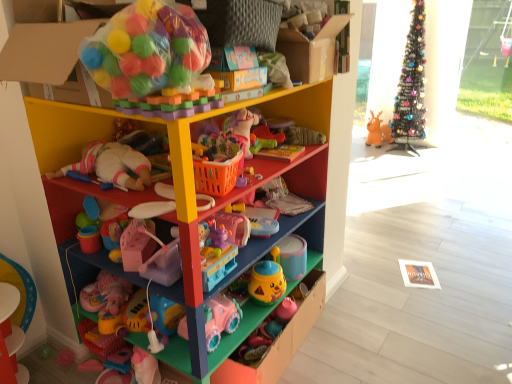
Identify the location of multicolored plastic shelf at center. The height and width of the screenshot is (384, 512). (296, 193).

Locate an element on the screen. Image resolution: width=512 pixels, height=384 pixels. metallic wire christmas tree at upper right is located at coordinates (411, 85).

Describe the element at coordinates (153, 61) in the screenshot. The width and height of the screenshot is (512, 384). I see `translucent plastic ball pit at upper left, which is the first toy from left to right` at that location.

Where is `transparent glass door at upper right`? This screenshot has width=512, height=384. transparent glass door at upper right is located at coordinates (488, 61).

Considering the sizes of objects metallic wire christmas tree at upper right and pink plastic toy at center, positioned as the third toy in front-to-back order, in the image provided, who is wider, metallic wire christmas tree at upper right or pink plastic toy at center, positioned as the third toy in front-to-back order,?

metallic wire christmas tree at upper right is wider.

Are metallic wire christmas tree at upper right and pink plastic toy at center, the fourth toy from the top, located far from each other?

metallic wire christmas tree at upper right is positioned a significant distance from pink plastic toy at center, the fourth toy from the top.

Which is more to the right, metallic wire christmas tree at upper right or pink plastic toy at center, positioned as the third toy in front-to-back order?

Positioned to the right is metallic wire christmas tree at upper right.

From a real-world perspective, who is located higher, metallic wire christmas tree at upper right or pink plastic toy at center, positioned as the third toy in front-to-back order?

In real-world perspective, metallic wire christmas tree at upper right is above.

From a real-world perspective, which object rests below the other?

pink plastic toy car at lower center, the fifth toy when ordered from right to left.

Does point (187, 332) appear closer or farther from the camera than point (254, 143)?

Point (187, 332) appears to be closer to the viewer than point (254, 143).

From the picture: Is rubber duck at center, acting as the third toy starting from the top, at the back of pink plastic toy car at lower center, which is the 1th toy in bottom-to-top order?

No, pink plastic toy car at lower center, which is the 1th toy in bottom-to-top order, is not facing the opposite direction of rubber duck at center, acting as the third toy starting from the top.

From the image's perspective, which object appears higher, pink plastic toy car at lower center, acting as the sixth toy starting from the top, or rubber duck at center, acting as the third toy starting from the top?

rubber duck at center, acting as the third toy starting from the top, appears higher in the image.

Which of these two, pink plastic toy at center, the fourth toy from the top, or pink plastic toy car at lower center, placed as the second toy when sorted from front to back, is wider?

With larger width is pink plastic toy at center, the fourth toy from the top.

Does pink plastic toy at center, positioned as the third toy in front-to-back order, have a larger size compared to pink plastic toy car at lower center, acting as the sixth toy starting from the top?

Incorrect, pink plastic toy at center, positioned as the third toy in front-to-back order, is not larger than pink plastic toy car at lower center, acting as the sixth toy starting from the top.

From the image's perspective, does pink plastic toy at center, the 4th toy viewed from the back, appear higher than pink plastic toy car at lower center, which ranks as the 5th toy in back-to-front order?

Yes, from the image's perspective, pink plastic toy at center, the 4th toy viewed from the back, is on top of pink plastic toy car at lower center, which ranks as the 5th toy in back-to-front order.

What's the angular difference between pink plastic toy at center, acting as the 3th toy starting from the left, and pink plastic toy car at lower center, which is the 1th toy in bottom-to-top order,'s facing directions?

The facing directions of pink plastic toy at center, acting as the 3th toy starting from the left, and pink plastic toy car at lower center, which is the 1th toy in bottom-to-top order, are 8 degrees apart.

From the image's perspective, is orange plastic basket at center on transparent glass door at upper right?

No, from the image's perspective, orange plastic basket at center is not over transparent glass door at upper right.

Considering the sizes of orange plastic basket at center and transparent glass door at upper right in the image, is orange plastic basket at center wider or thinner than transparent glass door at upper right?

In the image, orange plastic basket at center appears to be wider than transparent glass door at upper right.

Could you tell me if orange plastic basket at center is facing transparent glass door at upper right?

No, orange plastic basket at center is not facing towards transparent glass door at upper right.

How different are the orientations of orange plastic basket at center and transparent glass door at upper right in degrees?

The angular difference between orange plastic basket at center and transparent glass door at upper right is 103 degrees.

In the scene shown: Does matte plastic drawer at center turn towards multicolored plastic shelf at center?

Yes, matte plastic drawer at center is turned towards multicolored plastic shelf at center.

Are matte plastic drawer at center and multicolored plastic shelf at center far apart?

No, matte plastic drawer at center is in close proximity to multicolored plastic shelf at center.

In the image, is matte plastic drawer at center on the left side or the right side of multicolored plastic shelf at center?

matte plastic drawer at center is positioned on multicolored plastic shelf at center's right side.

Who is more distant, pink plastic toy at center, acting as the 3th toy starting from the left, or orange plastic basket at center?

pink plastic toy at center, acting as the 3th toy starting from the left.

From a real-world perspective, which object rests below the other?

pink plastic toy at center, the fourth toy from the top.

Is pink plastic toy at center, placed as the fourth toy when sorted from right to left, far away from orange plastic basket at center?

No, pink plastic toy at center, placed as the fourth toy when sorted from right to left, is not far away from orange plastic basket at center.

Which is more to the right, pink plastic toy at center, placed as the fourth toy when sorted from right to left, or orange plastic basket at center?

From the viewer's perspective, pink plastic toy at center, placed as the fourth toy when sorted from right to left, appears more on the right side.

Is orange plastic basket at center beside translucent plastic ball pit at upper left, acting as the second toy starting from the top?

No, orange plastic basket at center is not touching translucent plastic ball pit at upper left, acting as the second toy starting from the top.

Can you confirm if orange plastic basket at center is smaller than translucent plastic ball pit at upper left, the fifth toy positioned from the bottom?

Yes, orange plastic basket at center is smaller than translucent plastic ball pit at upper left, the fifth toy positioned from the bottom.

Does orange plastic basket at center come in front of translucent plastic ball pit at upper left, acting as the second toy starting from the top?

No, it is not.

Is point (224, 183) positioned in front of point (214, 83)?

No, (224, 183) is further to viewer.

This screenshot has height=384, width=512. I want to click on the 3rd toy in front when counting from the metallic wire christmas tree at upper right, so click(257, 218).

Which toy is the 3rd one when counting from the back of the pink plastic toy car at lower center, acting as the sixth toy starting from the top? Please provide its 2D coordinates.

[(264, 139)]

When comparing their distances from translucent plastic ball pit at upper left, acting as the second toy starting from the top, does yellow matte cup at center, which is counted as the 2th toy, starting from the bottom, or matte plastic drawer at center seem closer?

yellow matte cup at center, which is counted as the 2th toy, starting from the bottom, lies closer to translucent plastic ball pit at upper left, acting as the second toy starting from the top, than the other object.

When comparing their distances from translucent plastic ball pit at upper left, which is counted as the sixth toy, starting from the right, does multicolored plastic shelf at center or transparent glass door at upper right seem further?

transparent glass door at upper right lies further to translucent plastic ball pit at upper left, which is counted as the sixth toy, starting from the right, than the other object.

Estimate the real-world distances between objects in this image. Which object is further from pink plastic toy at center, the fourth toy from the top, orange rubber reindeer at center, which appears as the first toy when viewed from the top, or translucent plastic ball pit at upper left, acting as the second toy starting from the top?

Among the two, orange rubber reindeer at center, which appears as the first toy when viewed from the top, is located further to pink plastic toy at center, the fourth toy from the top.

Consider the image. When comparing their distances from translucent plastic ball pit at upper left, which is counted as the first toy, starting from the front, does transparent glass door at upper right or metallic wire christmas tree at upper right seem further?

Based on the image, transparent glass door at upper right appears to be further to translucent plastic ball pit at upper left, which is counted as the first toy, starting from the front.

Which object lies further to the anchor point orange rubber reindeer at center, which ranks as the first toy in right-to-left order, pink plastic toy at center, the 4th toy viewed from the back, or metallic wire christmas tree at upper right?

The object further to orange rubber reindeer at center, which ranks as the first toy in right-to-left order, is pink plastic toy at center, the 4th toy viewed from the back.

Based on their spatial positions, is translucent plastic ball pit at upper left, which is counted as the sixth toy, starting from the right, or pink plastic toy at center, placed as the fourth toy when sorted from right to left, closer to rubber duck at center, arranged as the 2th toy when viewed from the right?

Among the two, pink plastic toy at center, placed as the fourth toy when sorted from right to left, is located nearer to rubber duck at center, arranged as the 2th toy when viewed from the right.

Based on their spatial positions, is yellow matte cup at center, arranged as the 3th toy when viewed from the back, or orange rubber reindeer at center, which is counted as the first toy, starting from the back, closer to metallic wire christmas tree at upper right?

Among the two, orange rubber reindeer at center, which is counted as the first toy, starting from the back, is located nearer to metallic wire christmas tree at upper right.

When comparing their distances from orange rubber reindeer at center, which appears as the first toy when viewed from the top, does pink plastic toy car at lower center, acting as the sixth toy starting from the top, or rubber duck at center, acting as the fifth toy starting from the front, seem further?

Among the two, pink plastic toy car at lower center, acting as the sixth toy starting from the top, is located further to orange rubber reindeer at center, which appears as the first toy when viewed from the top.

The width and height of the screenshot is (512, 384). I want to click on basket positioned between translucent plastic ball pit at upper left, which is counted as the sixth toy, starting from the right, and transparent glass door at upper right from near to far, so pos(216,175).

Find the location of a particular element. The image size is (512, 384). drawer between multicolored plastic shelf at center and orange rubber reindeer at center, which appears as the 6th toy when viewed from the left, along the z-axis is located at coordinates (280, 339).

Locate an element on the screen. The image size is (512, 384). basket between multicolored plastic shelf at center and metallic wire christmas tree at upper right along the z-axis is located at coordinates (216, 175).

At what (x,y) coordinates should I click in order to perform the action: click on basket between multicolored plastic shelf at center and rubber duck at center, arranged as the 2th toy when viewed from the right, along the z-axis. Please return your answer as a coordinate pair (x, y). Looking at the image, I should click on (216, 175).